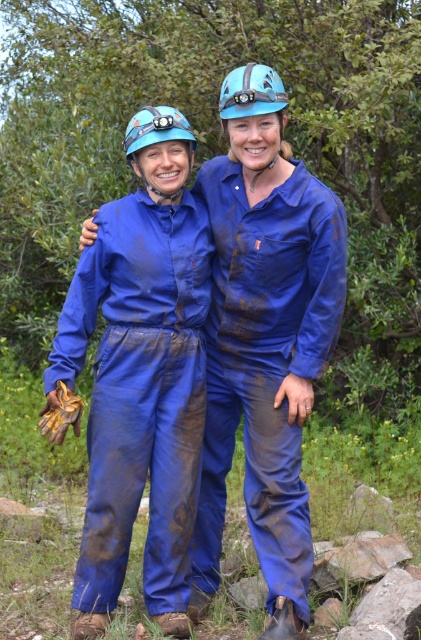
Which is below, blue matte jumpsuit at center or matte blue helmet at upper center?

Positioned lower is blue matte jumpsuit at center.

Does blue matte jumpsuit at center lie behind matte blue helmet at upper center?

No, blue matte jumpsuit at center is in front of matte blue helmet at upper center.

Is point (220, 388) in front of point (130, 122)?

No, it is behind (130, 122).

At what (x,y) coordinates should I click in order to perform the action: click on blue matte jumpsuit at center. Please return your answer as a coordinate pair (x, y). This screenshot has height=640, width=421. Looking at the image, I should click on (266, 353).

Can you confirm if blue matte jumpsuit at center is thinner than blue matte jumpsuit at left?

Yes, blue matte jumpsuit at center is thinner than blue matte jumpsuit at left.

Between point (279, 400) and point (151, 292), which one is positioned behind?

Point (151, 292)

Is point (330, 316) more distant than point (85, 509)?

That is False.

I want to click on blue matte jumpsuit at center, so click(x=266, y=353).

Between blue matte helmet at center and blue matte helmet at upper center, which one has more height?

Standing taller between the two is blue matte helmet at center.

Can you confirm if blue matte helmet at center is thinner than blue matte helmet at upper center?

Indeed, blue matte helmet at center has a lesser width compared to blue matte helmet at upper center.

Who is more forward, (268, 68) or (234, 96)?

Positioned in front is point (234, 96).

Image resolution: width=421 pixels, height=640 pixels. I want to click on blue matte helmet at center, so [x=250, y=92].